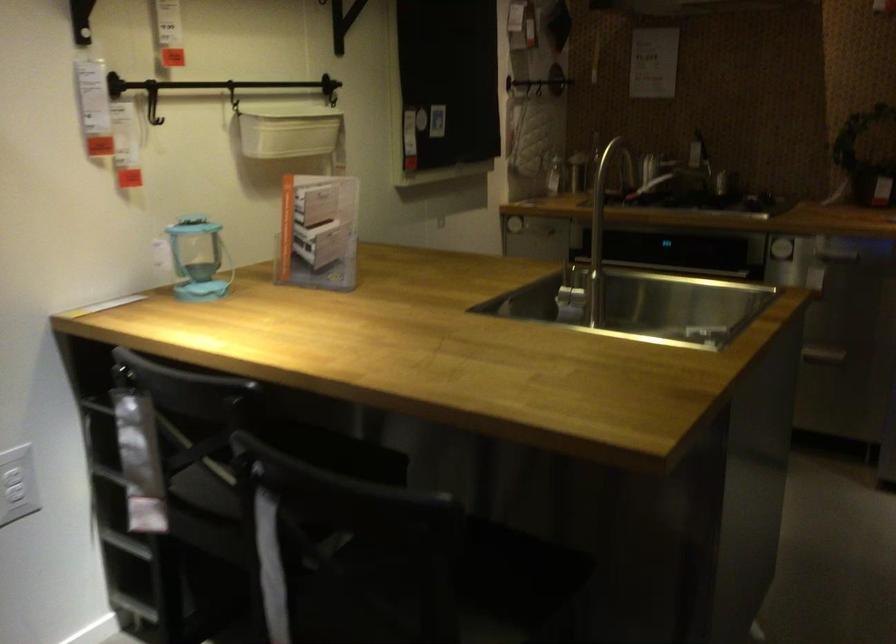
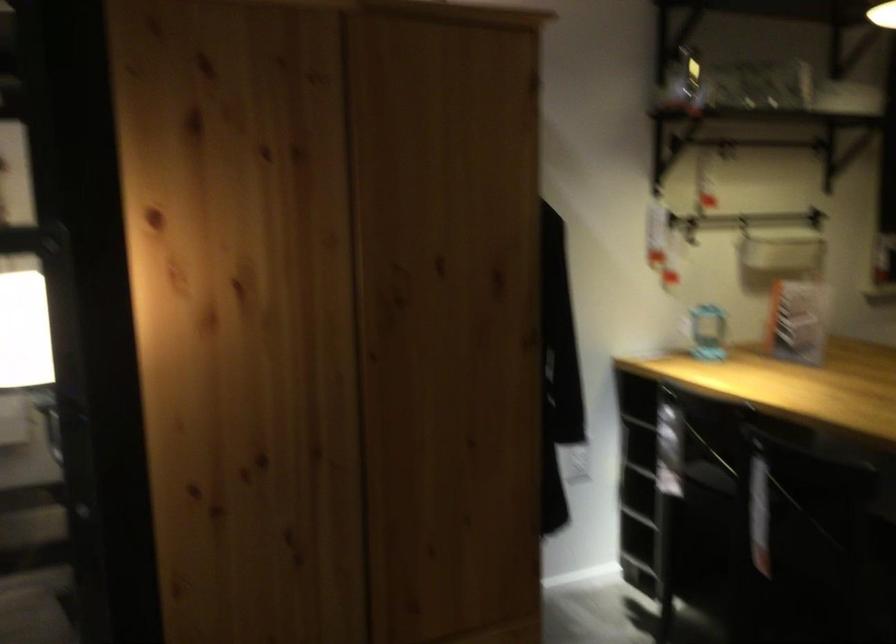
Locate, in the second image, the point that corresponds to point 122,116 in the first image.

(690, 228)